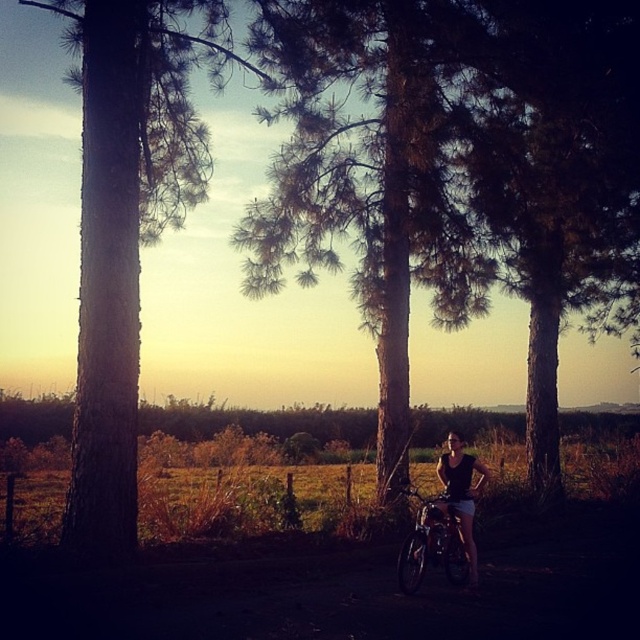
Question: Is brown rough bark tree at left bigger than black fabric tank top at center?

Choices:
 (A) yes
 (B) no

Answer: (A)

Question: Which object is closer to the camera taking this photo?

Choices:
 (A) brown rough bark tree at left
 (B) shiny metallic bicycle at center

Answer: (A)

Question: Is green textured tree at center bigger than brown rough bark tree at left?

Choices:
 (A) yes
 (B) no

Answer: (B)

Question: Which of these objects is positioned closest to the brown rough bark tree at left?

Choices:
 (A) black fabric tank top at center
 (B) shiny metallic bicycle at center
 (C) green textured tree at center

Answer: (C)

Question: Estimate the real-world distances between objects in this image. Which object is closer to the black fabric tank top at center?

Choices:
 (A) shiny metallic bicycle at center
 (B) green textured tree at center

Answer: (A)

Question: Can you confirm if green textured tree at center is positioned to the right of brown rough bark tree at left?

Choices:
 (A) yes
 (B) no

Answer: (A)